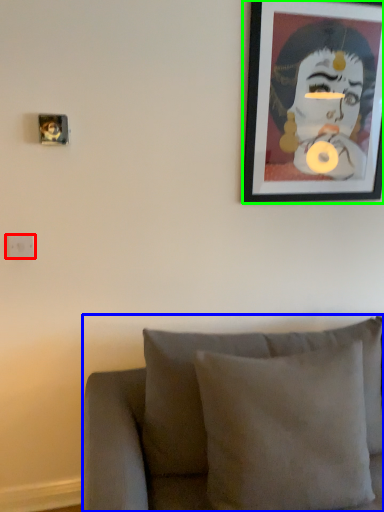
Question: Estimate the real-world distances between objects in this image. Which object is farther from electric outlet (highlighted by a red box), furniture (highlighted by a blue box) or picture frame (highlighted by a green box)?

Choices:
 (A) furniture
 (B) picture frame

Answer: (B)